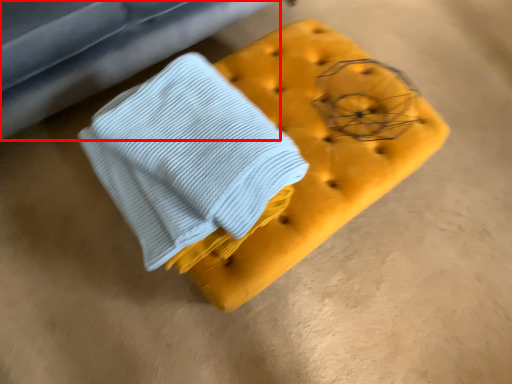
Question: Considering the relative positions of furniture (annotated by the red box) and furniture in the image provided, where is furniture (annotated by the red box) located with respect to the staircase?

Choices:
 (A) right
 (B) left

Answer: (B)